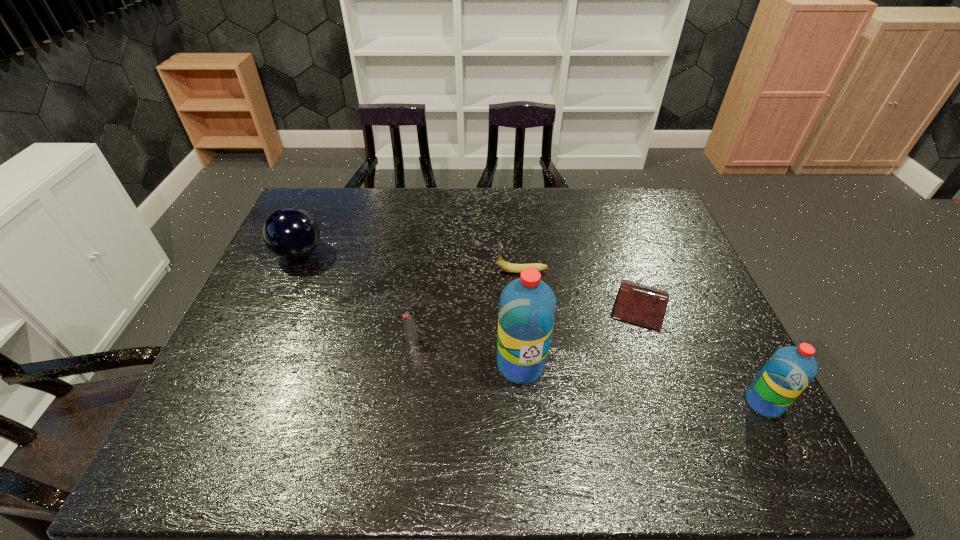
The height and width of the screenshot is (540, 960). Find the location of `the left water bottle`. the left water bottle is located at coordinates (527, 307).

Where is `the taller water bottle`? The image size is (960, 540). the taller water bottle is located at coordinates (527, 307).

The width and height of the screenshot is (960, 540). I want to click on the shorter water bottle, so click(787, 373).

This screenshot has width=960, height=540. In order to click on the second tallest object in this screenshot , I will do `click(787, 373)`.

I want to click on banana, so click(x=505, y=266).

At what (x,y) coordinates should I click in order to perform the action: click on bowling ball. Please return your answer as a coordinate pair (x, y). The image size is (960, 540). Looking at the image, I should click on (291, 233).

At what (x,y) coordinates should I click in order to perform the action: click on the leftmost object. Please return your answer as a coordinate pair (x, y). Looking at the image, I should click on (291, 233).

The width and height of the screenshot is (960, 540). I want to click on the second object from right to left, so click(x=643, y=305).

Identify the location of book. (643, 305).

This screenshot has width=960, height=540. Identify the location of the fifth object from right to left. (409, 321).